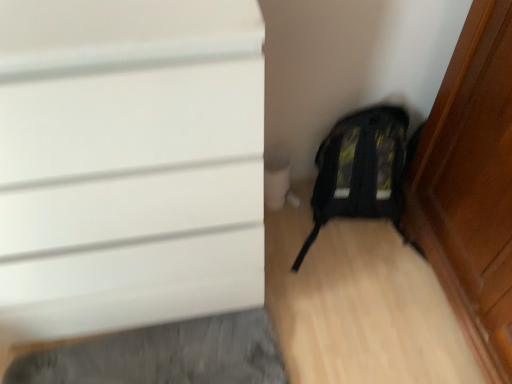
Question: From the image's perspective, is black fabric backpack at lower right over white matte door at upper left?

Choices:
 (A) yes
 (B) no

Answer: (B)

Question: Can you confirm if black fabric backpack at lower right is wider than white matte door at upper left?

Choices:
 (A) yes
 (B) no

Answer: (B)

Question: Does black fabric backpack at lower right lie behind white matte door at upper left?

Choices:
 (A) no
 (B) yes

Answer: (B)

Question: From the image's perspective, is black fabric backpack at lower right located beneath white matte door at upper left?

Choices:
 (A) yes
 (B) no

Answer: (A)

Question: From a real-world perspective, does black fabric backpack at lower right stand above white matte door at upper left?

Choices:
 (A) yes
 (B) no

Answer: (B)

Question: Considering the relative sizes of black fabric backpack at lower right and white matte door at upper left in the image provided, is black fabric backpack at lower right smaller than white matte door at upper left?

Choices:
 (A) no
 (B) yes

Answer: (B)

Question: From a real-world perspective, is white matte door at upper left positioned under black fabric backpack at lower right based on gravity?

Choices:
 (A) no
 (B) yes

Answer: (A)

Question: Considering the relative sizes of white matte door at upper left and black fabric backpack at lower right in the image provided, is white matte door at upper left wider than black fabric backpack at lower right?

Choices:
 (A) no
 (B) yes

Answer: (B)

Question: Is white matte door at upper left aimed at black fabric backpack at lower right?

Choices:
 (A) yes
 (B) no

Answer: (B)

Question: From the image's perspective, is white matte door at upper left on black fabric backpack at lower right?

Choices:
 (A) no
 (B) yes

Answer: (B)

Question: Is black fabric backpack at lower right completely or partially inside white matte door at upper left?

Choices:
 (A) no
 (B) yes

Answer: (A)

Question: Is white matte door at upper left closer to the viewer compared to black fabric backpack at lower right?

Choices:
 (A) no
 (B) yes

Answer: (B)

Question: From a real-world perspective, is white matte door at upper left physically located above or below black fabric backpack at lower right?

Choices:
 (A) above
 (B) below

Answer: (A)